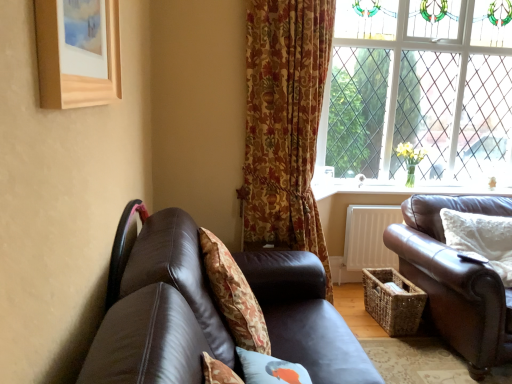
Question: Is white soft cushion at right, which is counted as the third pillow, starting from the front, bigger than floral fabric cushion at center, which is counted as the 2th pillow, starting from the front?

Choices:
 (A) no
 (B) yes

Answer: (A)

Question: Considering the relative positions of white soft cushion at right, which is counted as the third pillow, starting from the front, and floral fabric cushion at center, which is the second pillow in back-to-front order, in the image provided, is white soft cushion at right, which is counted as the third pillow, starting from the front, to the right of floral fabric cushion at center, which is the second pillow in back-to-front order, from the viewer's perspective?

Choices:
 (A) yes
 (B) no

Answer: (A)

Question: Would you say white soft cushion at right, which is counted as the third pillow, starting from the front, contains floral fabric cushion at center, which is the second pillow in back-to-front order?

Choices:
 (A) yes
 (B) no

Answer: (B)

Question: Can you see white soft cushion at right, which is the first pillow in right-to-left order, touching floral fabric cushion at center, which ranks as the 1th pillow in left-to-right order?

Choices:
 (A) yes
 (B) no

Answer: (B)

Question: Is white soft cushion at right, which is the first pillow in right-to-left order, completely or partially outside of floral fabric cushion at center, the third pillow positioned from the right?

Choices:
 (A) no
 (B) yes

Answer: (B)

Question: Does white soft cushion at right, which is the 3th pillow in left-to-right order, have a lesser width compared to floral fabric cushion at center, which is the second pillow in back-to-front order?

Choices:
 (A) no
 (B) yes

Answer: (A)

Question: Considering the relative sizes of floral fabric cushion at center, which ranks as the 1th pillow in left-to-right order, and brown leather couch at right, the 1th studio couch in the right-to-left sequence, in the image provided, is floral fabric cushion at center, which ranks as the 1th pillow in left-to-right order, thinner than brown leather couch at right, the 1th studio couch in the right-to-left sequence,?

Choices:
 (A) no
 (B) yes

Answer: (B)

Question: Are floral fabric cushion at center, the third pillow positioned from the right, and brown leather couch at right, arranged as the 2th studio couch when viewed from the left, beside each other?

Choices:
 (A) yes
 (B) no

Answer: (B)

Question: From a real-world perspective, is floral fabric cushion at center, which ranks as the 1th pillow in left-to-right order, over brown leather couch at right, arranged as the 2th studio couch when viewed from the left?

Choices:
 (A) no
 (B) yes

Answer: (B)

Question: Is floral fabric cushion at center, which is counted as the 2th pillow, starting from the front, taller than brown leather couch at right, the 1th studio couch in the right-to-left sequence?

Choices:
 (A) no
 (B) yes

Answer: (A)

Question: Is floral fabric cushion at center, which ranks as the 1th pillow in left-to-right order, further to camera compared to brown leather couch at right, the 1th studio couch in the right-to-left sequence?

Choices:
 (A) no
 (B) yes

Answer: (A)

Question: Does floral fabric cushion at center, which is counted as the 2th pillow, starting from the front, have a greater width compared to brown leather couch at right, the 1th studio couch in the right-to-left sequence?

Choices:
 (A) yes
 (B) no

Answer: (B)

Question: From the image's perspective, is white painted wood at lower right over wooden picture frame at upper left?

Choices:
 (A) yes
 (B) no

Answer: (B)